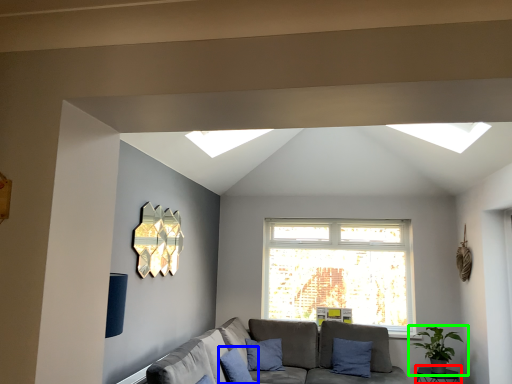
Question: Which object is the closest to the table (highlighted by a red box)? Choose among these: pillow (highlighted by a blue box) or houseplant (highlighted by a green box).

Choices:
 (A) pillow
 (B) houseplant

Answer: (B)